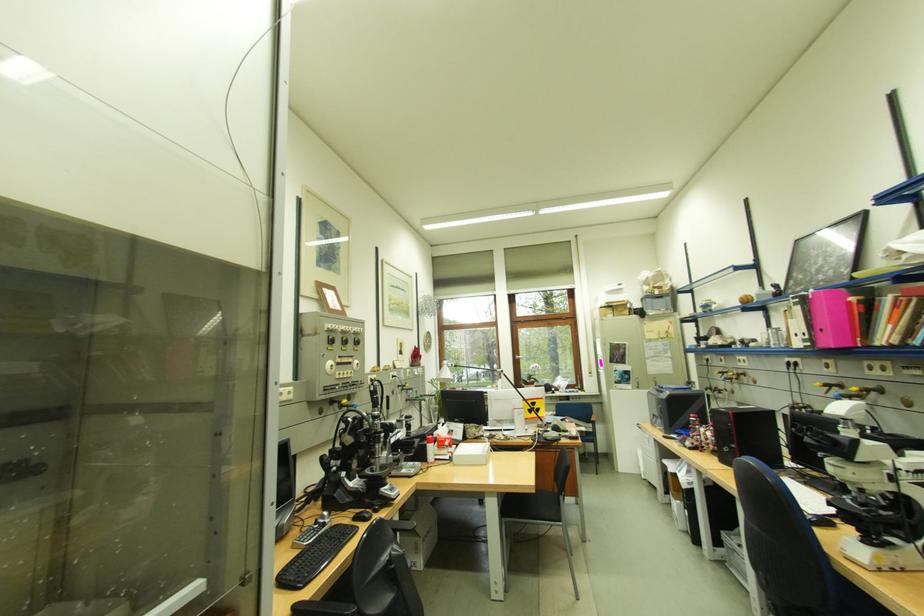
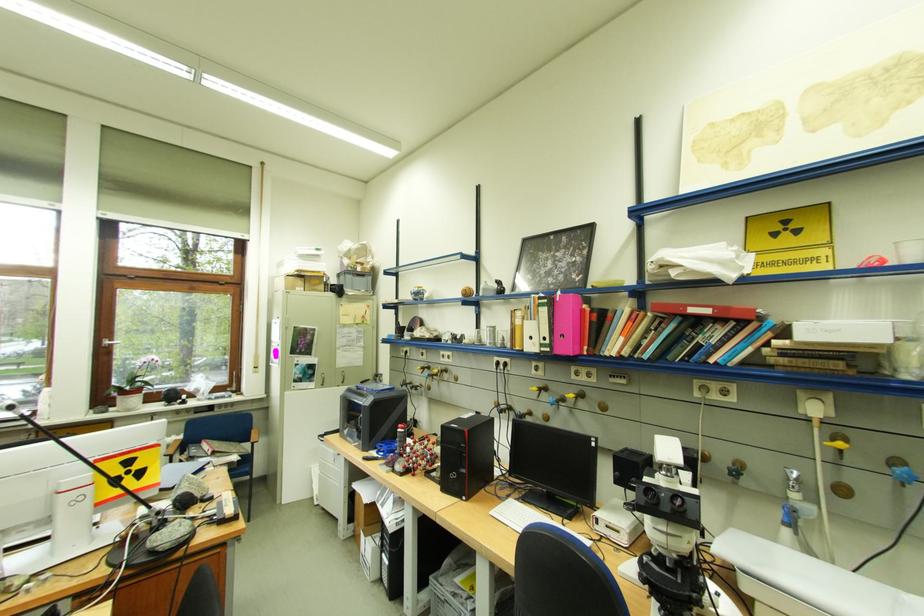
Locate, in the second image, the point that corresponds to point 820,345 in the first image.

(558, 351)